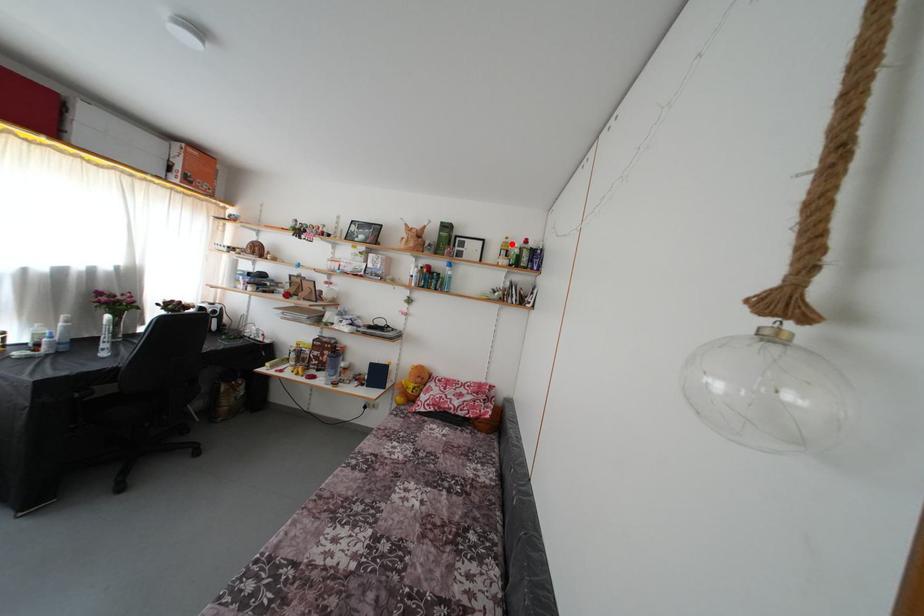
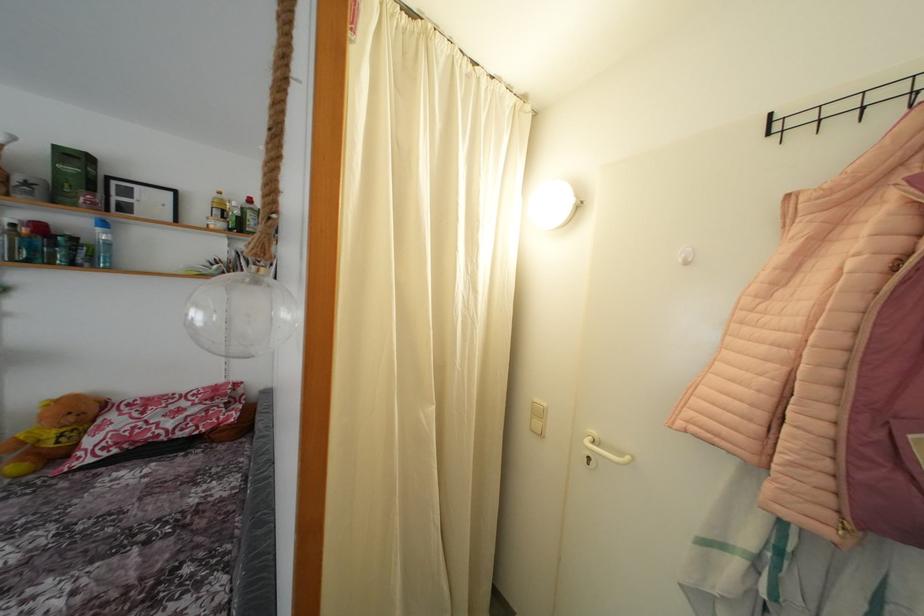
Locate, in the second image, the point that corresponds to the highlighted location in the first image.

(225, 199)